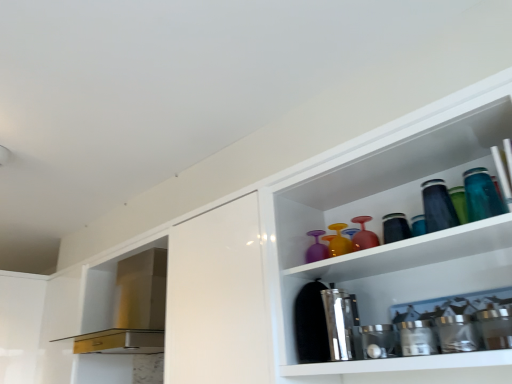
Where is `shiny metallic shaker at center`? The width and height of the screenshot is (512, 384). shiny metallic shaker at center is located at coordinates (341, 324).

What do you see at coordinates (341, 324) in the screenshot? The width and height of the screenshot is (512, 384). I see `shiny metallic shaker at center` at bounding box center [341, 324].

Measure the distance between point [360,357] and camera.

Point [360,357] and camera are 3.85 feet apart.

The width and height of the screenshot is (512, 384). I want to click on shiny metallic shaker at center, so (x=341, y=324).